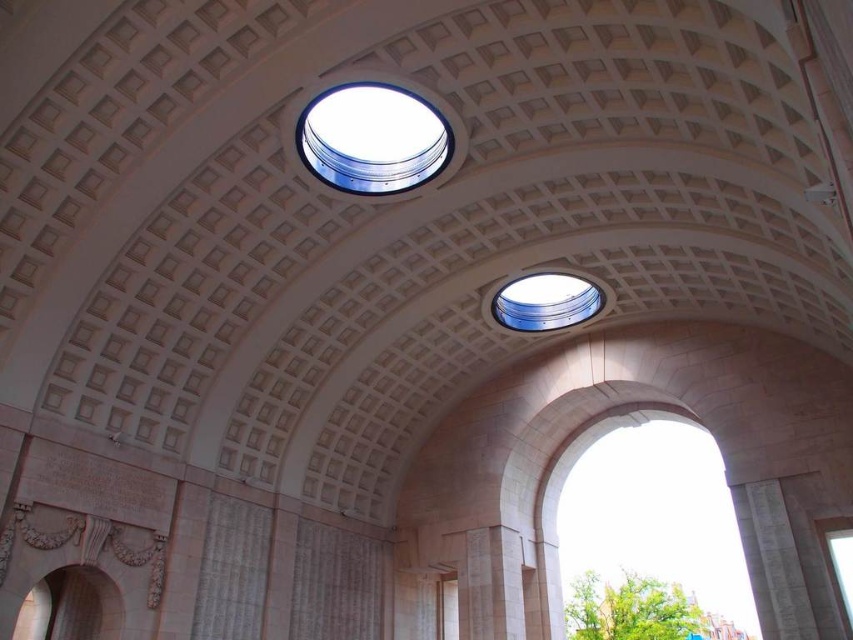
Measure the distance from clear glass dome at upper center to transparent glass window at center.

clear glass dome at upper center and transparent glass window at center are 14.99 meters apart from each other.

Between clear glass dome at upper center and transparent glass window at center, which one is positioned lower?

Positioned lower is transparent glass window at center.

Where is `clear glass dome at upper center`? clear glass dome at upper center is located at coordinates (372, 138).

I want to click on clear glass dome at upper center, so click(x=372, y=138).